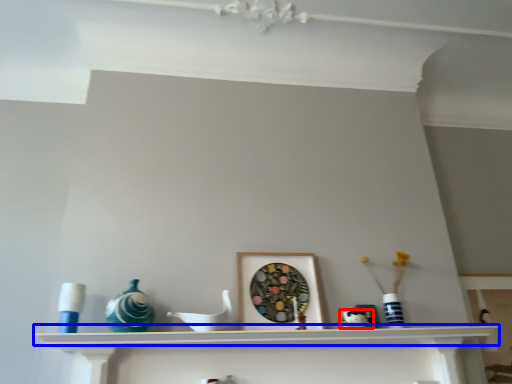
Question: Which object appears closest to the camera in this image, art (highlighted by a red box) or shelf (highlighted by a blue box)?

Choices:
 (A) art
 (B) shelf

Answer: (B)